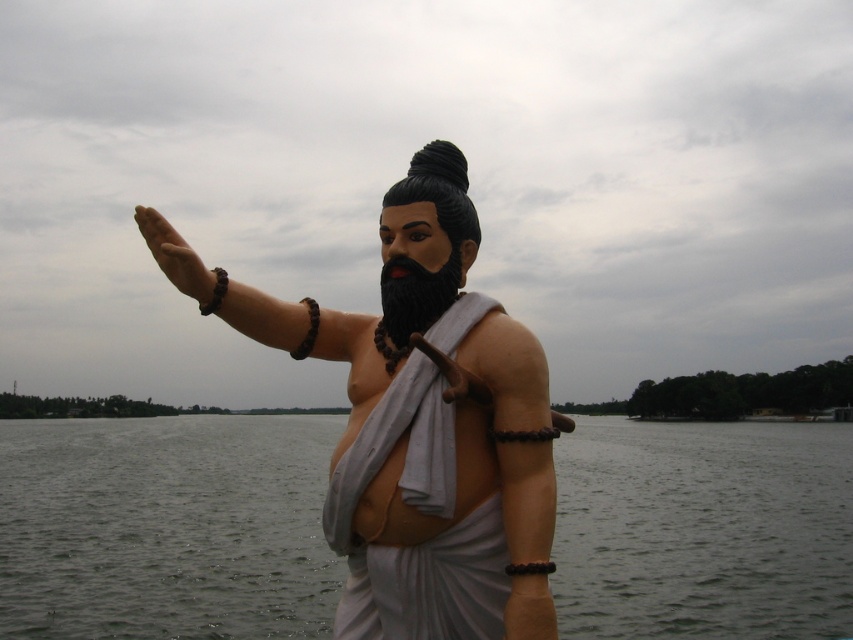
Which is behind, point (503, 403) or point (216, 276)?

The point (216, 276) is behind.

Can you confirm if matte white statue at center is positioned to the right of matte brown hand at upper center?

Yes, matte white statue at center is to the right of matte brown hand at upper center.

Is point (415, 595) closer to viewer compared to point (183, 269)?

Yes, point (415, 595) is closer to viewer.

This screenshot has width=853, height=640. I want to click on matte white statue at center, so [x=430, y=436].

Which of these two, transparent water at statue right or matte brown hand at upper center, stands shorter?

matte brown hand at upper center

From the picture: Who is more distant from viewer, (607, 627) or (183, 272)?

Point (607, 627)

I want to click on transparent water at statue right, so click(165, 528).

Does point (364, 336) come in front of point (425, 291)?

No, it is not.

Does matte white statue at center appear on the left side of black matte beard at center?

Yes, matte white statue at center is to the left of black matte beard at center.

At what (x,y) coordinates should I click in order to perform the action: click on matte white statue at center. Please return your answer as a coordinate pair (x, y). This screenshot has height=640, width=853. Looking at the image, I should click on (430, 436).

You are a GUI agent. You are given a task and a screenshot of the screen. Output one action in this format:
    pyautogui.click(x=<x>, y=<y>)
    Task: Click on the matte white statue at center
    
    Given the screenshot: What is the action you would take?
    click(x=430, y=436)